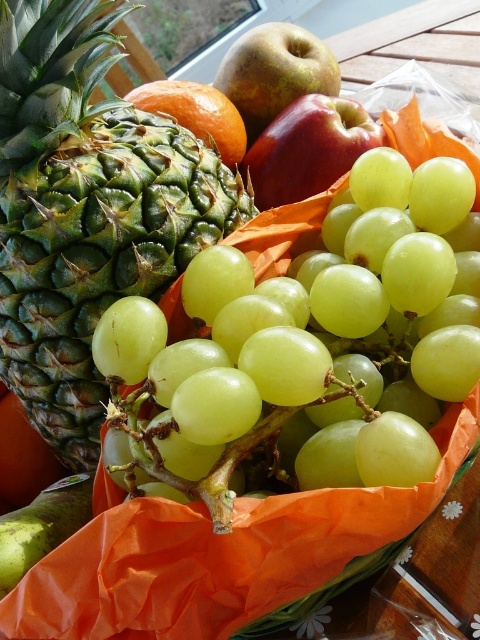
Question: Is green textured pineapple at upper left bigger than shiny red apple at center?

Choices:
 (A) no
 (B) yes

Answer: (B)

Question: Is shiny red apple at center bigger than shiny green apple at upper center?

Choices:
 (A) no
 (B) yes

Answer: (A)

Question: Among these objects, which one is nearest to the camera?

Choices:
 (A) green textured pineapple at upper left
 (B) shiny green apple at upper center
 (C) orange matte at center

Answer: (A)

Question: Which object appears closest to the camera in this image?

Choices:
 (A) green matte grapes at center
 (B) shiny green apple at upper center

Answer: (A)

Question: Can you confirm if green textured pineapple at upper left is smaller than shiny red apple at center?

Choices:
 (A) no
 (B) yes

Answer: (A)

Question: Which object appears closest to the camera in this image?

Choices:
 (A) green matte grapes at center
 (B) green textured pineapple at upper left

Answer: (A)